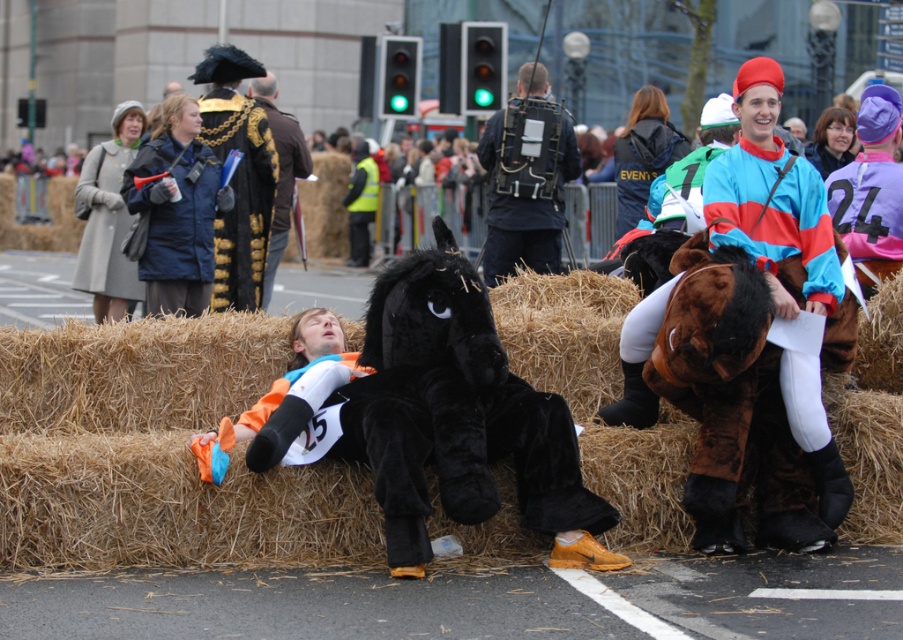
You are a photographer trying to capture both the brushed metal megaphone at upper left and the velvet black horse at center in a single frame. Which object should you focus on first to ensure both are in the frame?

The velvet black horse at center is taller than the brushed metal megaphone at upper left, so you should focus on the velvet black horse at center first to ensure both fit in the frame.

You are a photographer standing at the event. You want to take a photo of the black plush horse at center from a distance that is exactly 25 feet away. Is the current position of the photographer sufficient to achieve this?

The black plush horse at center is currently 25.64 feet away from the camera, which is slightly further than the desired 25 feet. To capture it at exactly 25 feet, the photographer needs to move approximately 0.64 feet closer.

You are a photographer at the event and want to capture a clear photo of the light gray wool coat at upper left without the brushed metal megaphone at upper left blocking it. How should you adjust your camera angle?

The brushed metal megaphone at upper left is positioned over the light gray wool coat at upper left. To avoid the megaphone blocking the coat, you should lower your camera angle so that you can see below the megaphone and capture the coat clearly.